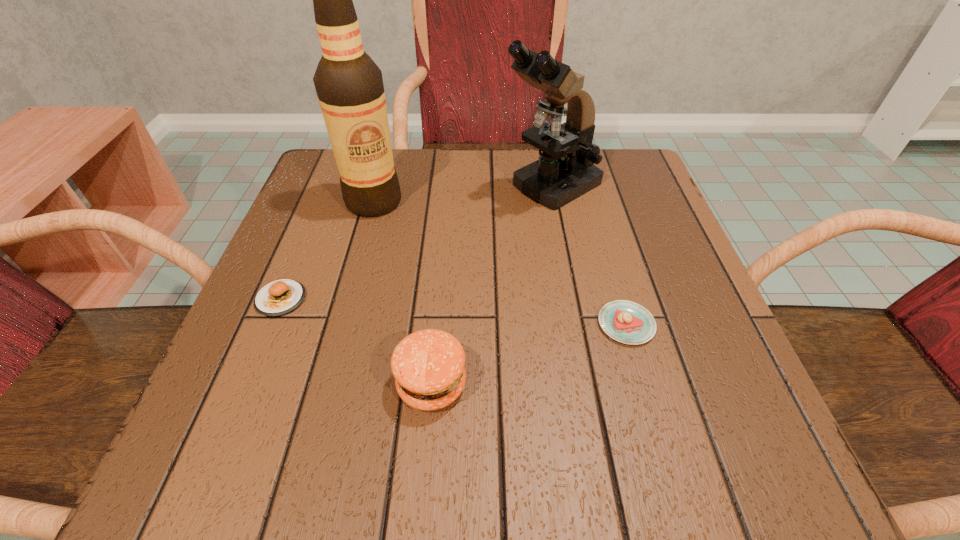
Locate an element on the screen. free location located 0.390m on the right of the nearest object is located at coordinates (744, 384).

Where is `free space located 0.200m on the back of the left food`? free space located 0.200m on the back of the left food is located at coordinates (318, 210).

Find the location of a particular element. The image size is (960, 540). free space located 0.170m on the back of the pastry is located at coordinates (600, 235).

In order to click on alcohol that is at the far edge in this screenshot , I will do `click(349, 85)`.

Locate an element on the screen. microscope present at the far edge is located at coordinates (565, 171).

Where is `object present at the near edge`? object present at the near edge is located at coordinates (428, 365).

You are a GUI agent. You are given a task and a screenshot of the screen. Output one action in this format:
    pyautogui.click(x=<x>, y=<y>)
    Task: Click on the alcohol at the left edge
    This screenshot has width=960, height=540.
    Given the screenshot: What is the action you would take?
    pyautogui.click(x=349, y=85)

Find the location of `food that is at the left edge`. food that is at the left edge is located at coordinates (280, 297).

Locate an element on the screen. This screenshot has height=540, width=960. microscope that is at the right edge is located at coordinates (565, 171).

Locate an element on the screen. Image resolution: width=960 pixels, height=540 pixels. pastry situated at the right edge is located at coordinates (627, 322).